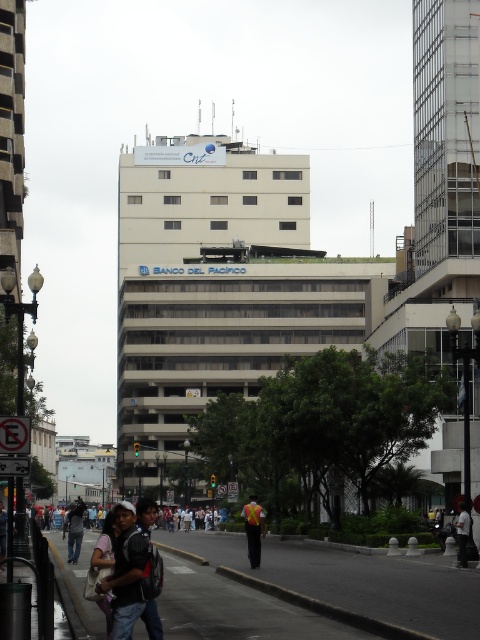
Question: Which object appears closest to the camera in this image?

Choices:
 (A) denim jacket at lower left
 (B) dark gray fabric jacket at lower right

Answer: (B)

Question: Does reflective yellow vest at center lie in front of dark gray fabric jacket at lower right?

Choices:
 (A) yes
 (B) no

Answer: (A)

Question: Does concrete sidewalk at lower left appear over white shirt at center?

Choices:
 (A) yes
 (B) no

Answer: (A)

Question: Does reflective yellow vest at center appear on the left side of white shirt at center?

Choices:
 (A) yes
 (B) no

Answer: (B)

Question: Which object is positioned closest to the white shirt at center?

Choices:
 (A) concrete sidewalk at lower left
 (B) denim jacket at lower left
 (C) reflective yellow vest at center

Answer: (B)

Question: Which point is farther to the camera?

Choices:
 (A) (462, 608)
 (B) (463, 538)
 (C) (172, 513)

Answer: (C)